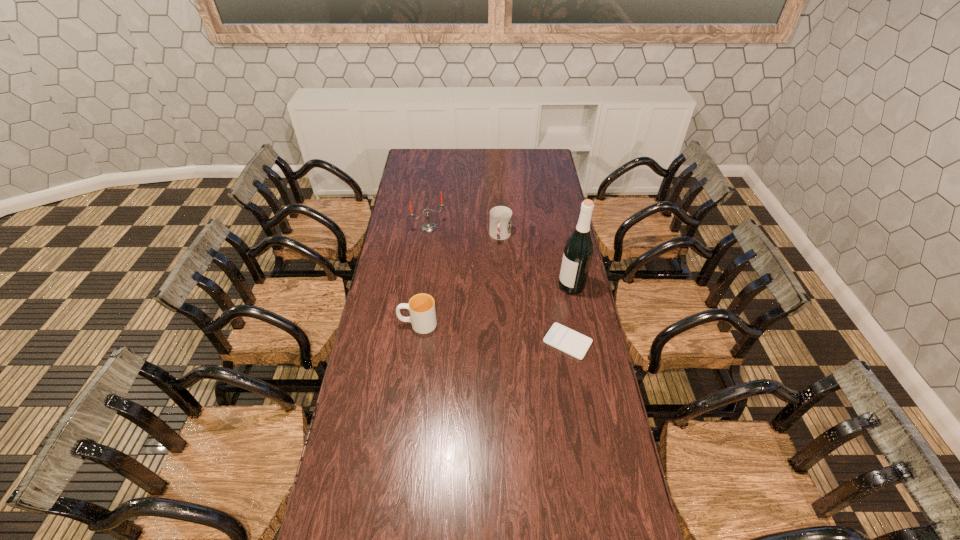
Where is `the nearer cup`? This screenshot has width=960, height=540. the nearer cup is located at coordinates (421, 306).

This screenshot has height=540, width=960. Find the location of `calculator`. calculator is located at coordinates point(560,337).

Identify the location of candle. (x=429, y=226).

In order to click on the third nearest object in this screenshot , I will do `click(578, 251)`.

What are the coordinates of `the tallest object` in the screenshot? It's located at (578, 251).

At what (x,y) coordinates should I click in order to perform the action: click on the farther cup. Please return your answer as a coordinate pair (x, y). Looking at the image, I should click on point(500,217).

The image size is (960, 540). Identify the location of the third object from left to right. (500, 217).

Identify the location of vacant space situated 0.110m with the handle on the side of the left cup. The height and width of the screenshot is (540, 960). (372, 324).

Identify the location of vacant space located on the back of the shortest object. (555, 266).

This screenshot has width=960, height=540. Find the location of `vacant point located on the front-facing side of the candle`. vacant point located on the front-facing side of the candle is located at coordinates (457, 259).